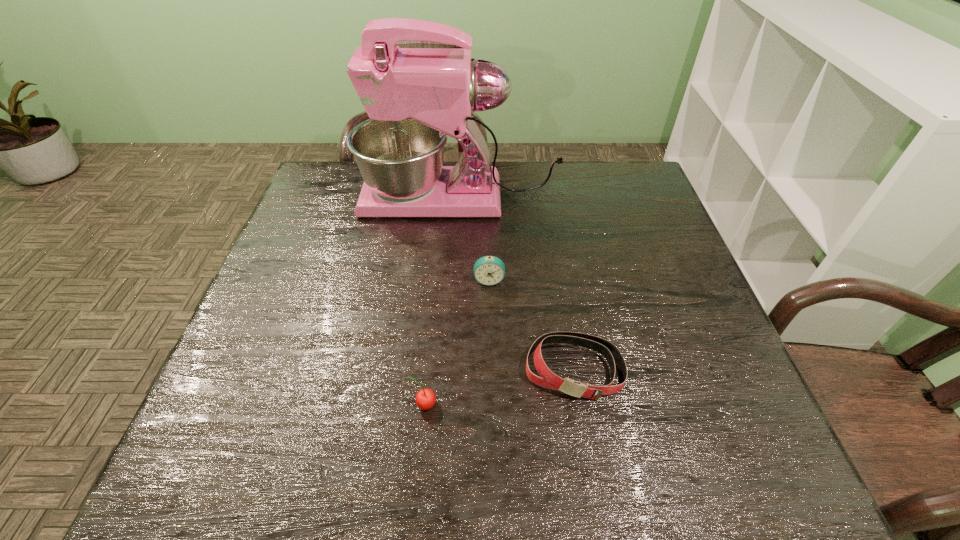
Where is `the farthest object`? The height and width of the screenshot is (540, 960). the farthest object is located at coordinates (415, 98).

At what (x,y) coordinates should I click in order to perform the action: click on the tallest object. Please return your answer as a coordinate pair (x, y). The image size is (960, 540). Looking at the image, I should click on click(x=415, y=98).

In order to click on alarm clock in this screenshot , I will do `click(489, 270)`.

Find the location of `cherry`. cherry is located at coordinates (425, 398).

Where is `the shortest object`? The height and width of the screenshot is (540, 960). the shortest object is located at coordinates (548, 379).

I want to click on vacant area located 0.110m on the face of the mixer, so click(324, 198).

This screenshot has height=540, width=960. I want to click on free location located 0.090m on the face of the mixer, so click(x=331, y=198).

Where is `vacant space located 0.160m on the face of the mixer`? This screenshot has width=960, height=540. vacant space located 0.160m on the face of the mixer is located at coordinates (307, 198).

Where is `blank space located on the front-facing side of the alarm clock`? This screenshot has height=540, width=960. blank space located on the front-facing side of the alarm clock is located at coordinates (492, 416).

You are a GUI agent. You are given a task and a screenshot of the screen. Output one action in this format:
    pyautogui.click(x=<x>, y=<y>)
    Task: Click on the free region located 0.310m on the right of the cherry
    The image size is (960, 540).
    Given the screenshot: What is the action you would take?
    pyautogui.click(x=598, y=404)